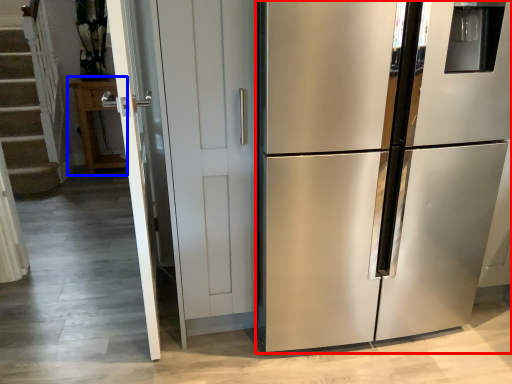
Question: Which object appears farthest to the camera in this image, refrigerator (highlighted by a red box) or cabinetry (highlighted by a blue box)?

Choices:
 (A) refrigerator
 (B) cabinetry

Answer: (B)